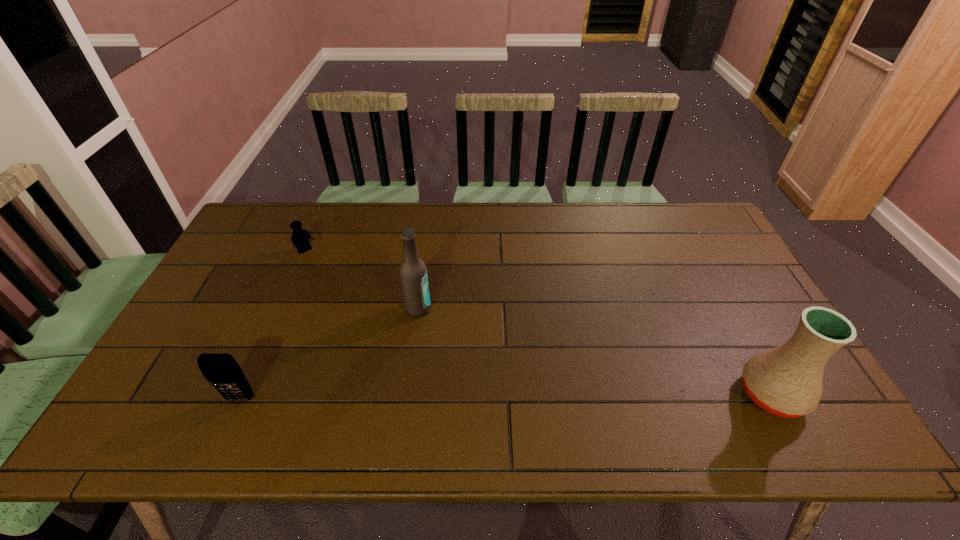
I want to click on the third tallest object, so click(221, 370).

Where is `pottery`? Image resolution: width=960 pixels, height=540 pixels. pottery is located at coordinates [786, 381].

At what (x,y) coordinates should I click in order to perform the action: click on Lego. Please return your answer as a coordinate pair (x, y). This screenshot has width=960, height=540. Looking at the image, I should click on (300, 236).

Identify the location of the farthest object. (300, 236).

You are a GUI agent. You are given a task and a screenshot of the screen. Output one action in this format:
    pyautogui.click(x=<x>, y=<y>)
    Task: Click on the second object from right to left
    
    Given the screenshot: What is the action you would take?
    pyautogui.click(x=413, y=272)

Find the location of a particular element. This screenshot has width=960, height=540. beer bottle is located at coordinates (413, 272).

Locate an element on the screen. blank space located 0.290m on the left of the rightmost object is located at coordinates (617, 394).

This screenshot has width=960, height=540. I want to click on free space located on the front-facing side of the farthest object, so click(329, 275).

This screenshot has width=960, height=540. Identify the location of vacant space located on the front-facing side of the farthest object. (328, 274).

At what (x,y) coordinates should I click in order to perform the action: click on vacant space situated 0.240m on the front-facing side of the farthest object. Please return your answer as a coordinate pair (x, y). This screenshot has width=960, height=540. Looking at the image, I should click on (349, 296).